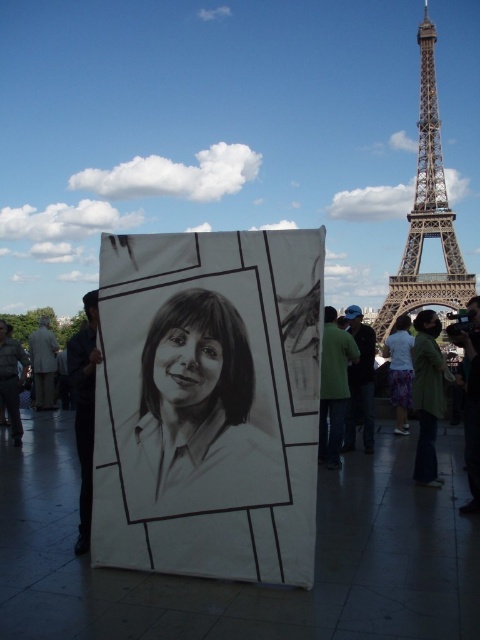
Who is taller, pencil sketch portrait at center or white cotton dress at center-right?

Standing taller between the two is pencil sketch portrait at center.

In the scene shown: Is pencil sketch portrait at center thinner than white cotton dress at center-right?

No, pencil sketch portrait at center is not thinner than white cotton dress at center-right.

Is point (142, 445) farther from viewer compared to point (397, 349)?

No.

Find the location of a particular element. The width and height of the screenshot is (480, 640). pencil sketch portrait at center is located at coordinates (197, 417).

Is pencil sketch portrait at center closer to the viewer compared to brown metal eiffel tower at right?

No, it is behind brown metal eiffel tower at right.

The height and width of the screenshot is (640, 480). I want to click on pencil sketch portrait at center, so click(x=197, y=417).

The image size is (480, 640). What are the coordinates of `pencil sketch portrait at center` in the screenshot? It's located at (197, 417).

Can you confirm if brown metal eiffel tower at right is positioned above white cotton dress at center-right?

Yes.

Where is `brown metal eiffel tower at right`? The width and height of the screenshot is (480, 640). brown metal eiffel tower at right is located at coordinates pos(427,212).

Who is more distant from viewer, (430, 83) or (392, 362)?

The point (430, 83) is more distant.

Where is `brown metal eiffel tower at right`? This screenshot has width=480, height=640. brown metal eiffel tower at right is located at coordinates (427, 212).